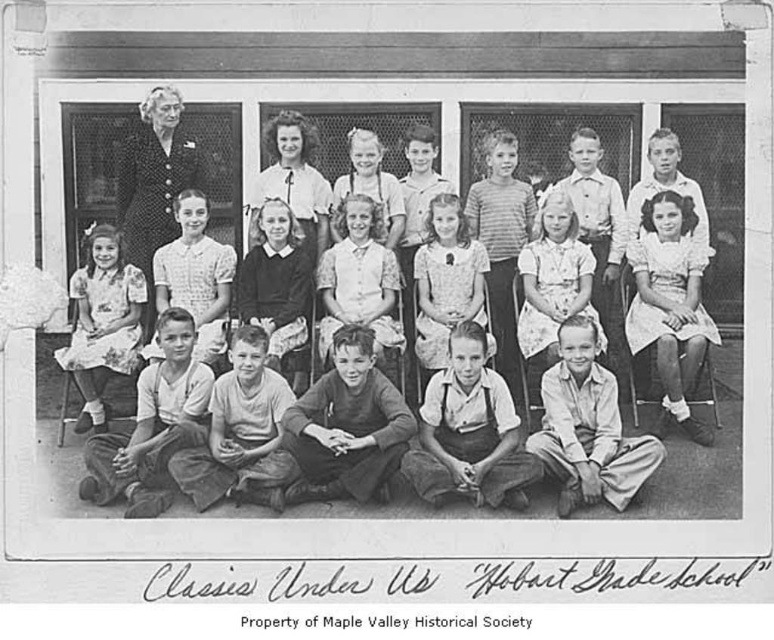
You are a photographer standing at the camera position in the school photo scene. You want to ensure the light pink dress at center is in focus while keeping the background slightly blurred. Which camera setting adjustment would help achieve this effect?

To achieve a blurred background while keeping the light pink dress at center in focus, adjust the camera aperture to a wider setting, such as a lower fstop number. This will create a shallower depth of field, isolating the subject from the background.

You are a photographer adjusting the camera focus. The light pink dress at center and dark fabric suit at upper left are both in the frame. Which subject should you focus on first if you want to ensure the taller one is sharp?

The dark fabric suit at upper left is taller than the light pink dress at center, so focus on the dark fabric suit at upper left first to ensure it is sharp.